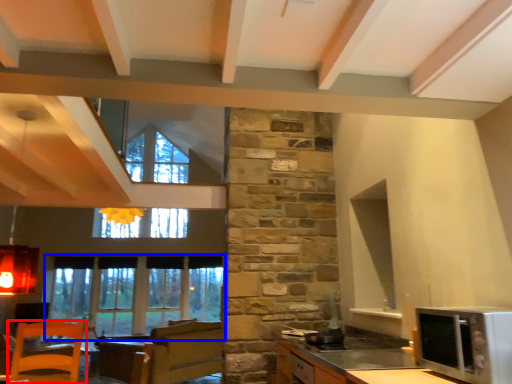
Question: Which point is closer to the camera, chair (highlighted by a red box) or window (highlighted by a blue box)?

Choices:
 (A) chair
 (B) window

Answer: (A)